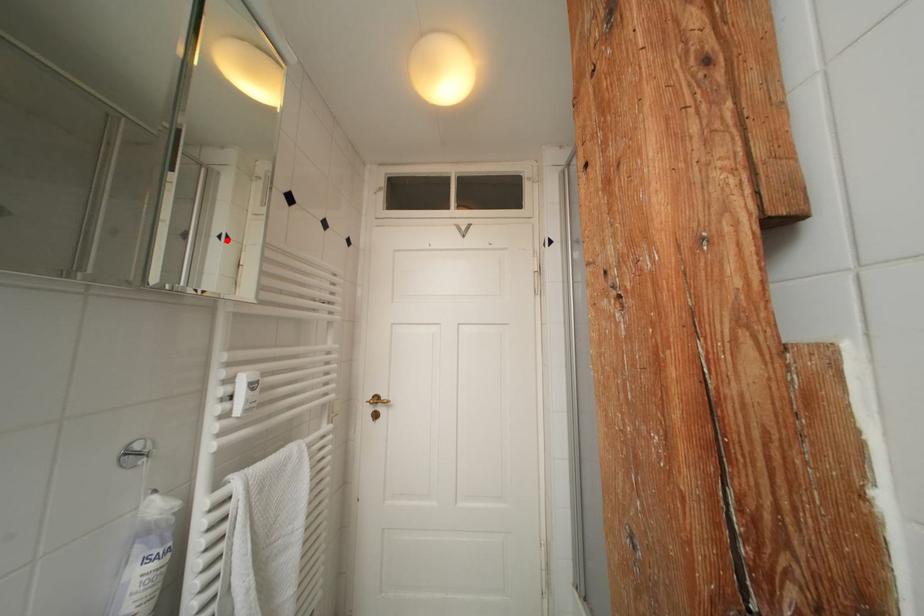
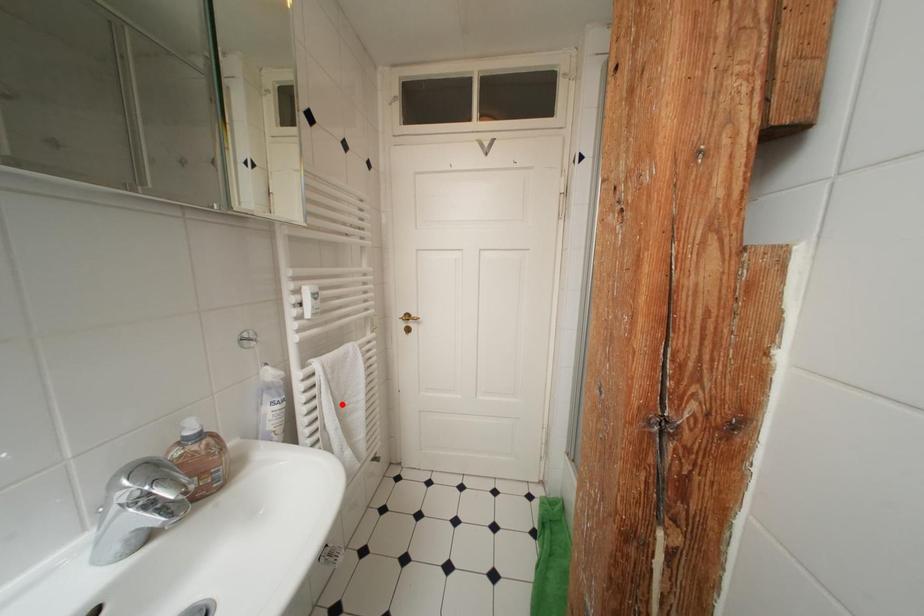
I am providing you with two images of the same scene from different viewpoints. A red point is marked on the first image and another point is marked on the second image. Are the points marked in image1 and image2 representing the same 3D position?

No